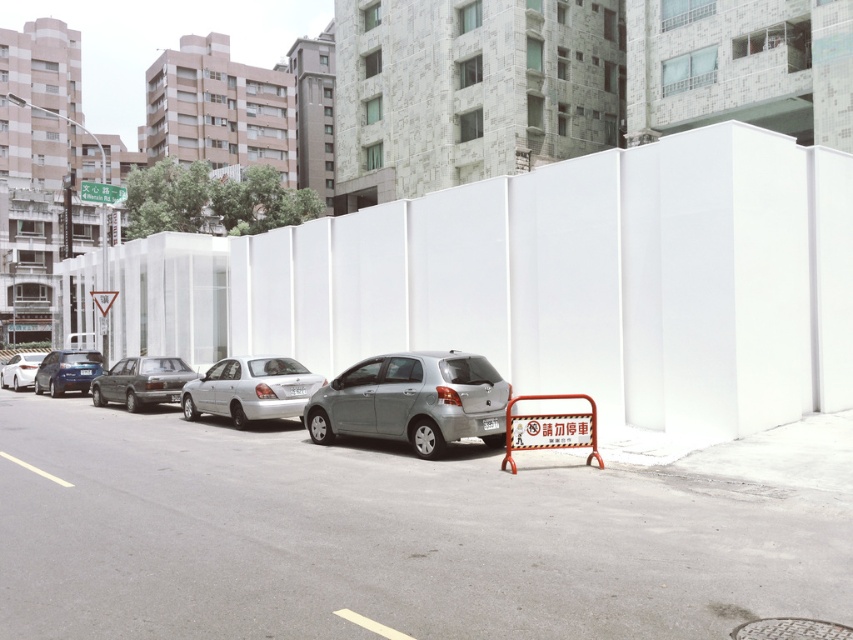
Question: Does matte gray sedan at center have a smaller size compared to green plastic sign at upper left?

Choices:
 (A) yes
 (B) no

Answer: (B)

Question: Which point appears closest to the camera in this image?

Choices:
 (A) (10, 365)
 (B) (123, 401)
 (C) (80, 196)

Answer: (B)

Question: Can you confirm if white plastic barrier at center is positioned above satin silver sedan at center?

Choices:
 (A) no
 (B) yes

Answer: (B)

Question: Among these points, which one is farthest from the camera?

Choices:
 (A) (100, 364)
 (B) (12, 378)

Answer: (B)

Question: Which object appears closest to the camera in this image?

Choices:
 (A) white plastic barrier at center
 (B) green plastic sign at upper left
 (C) satin silver sedan at center

Answer: (A)

Question: Is matte gray sedan at center further to camera compared to silver metallic car at left?

Choices:
 (A) no
 (B) yes

Answer: (A)